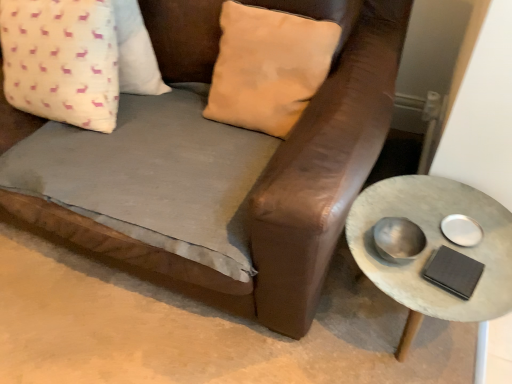
Question: Does white fabric pillow with pink deer pattern at upper left, placed as the 1th pillow when sorted from left to right, have a larger size compared to rustic concrete side table at right?

Choices:
 (A) yes
 (B) no

Answer: (B)

Question: Is white fabric pillow with pink deer pattern at upper left, the 2th pillow positioned from the right, to the right of rustic concrete side table at right from the viewer's perspective?

Choices:
 (A) yes
 (B) no

Answer: (B)

Question: Can you confirm if white fabric pillow with pink deer pattern at upper left, placed as the 1th pillow when sorted from left to right, is wider than rustic concrete side table at right?

Choices:
 (A) yes
 (B) no

Answer: (B)

Question: Is white fabric pillow with pink deer pattern at upper left, the 2th pillow positioned from the right, behind rustic concrete side table at right?

Choices:
 (A) yes
 (B) no

Answer: (A)

Question: Is white fabric pillow with pink deer pattern at upper left, the 2th pillow positioned from the right, smaller than rustic concrete side table at right?

Choices:
 (A) yes
 (B) no

Answer: (A)

Question: Is white fabric pillow with pink deer pattern at upper left, placed as the 1th pillow when sorted from left to right, next to rustic concrete side table at right?

Choices:
 (A) no
 (B) yes

Answer: (A)

Question: Is brown leather couch at center completely or partially outside of beige suede pillow at upper center, which is the first pillow in right-to-left order?

Choices:
 (A) no
 (B) yes

Answer: (B)

Question: Can you confirm if brown leather couch at center is wider than beige suede pillow at upper center, which is the first pillow in right-to-left order?

Choices:
 (A) no
 (B) yes

Answer: (B)

Question: Is brown leather couch at center oriented towards beige suede pillow at upper center, which is the first pillow in right-to-left order?

Choices:
 (A) no
 (B) yes

Answer: (A)

Question: Is brown leather couch at center taller than beige suede pillow at upper center, which is the first pillow in right-to-left order?

Choices:
 (A) yes
 (B) no

Answer: (B)

Question: Is brown leather couch at center not near beige suede pillow at upper center, which is the first pillow in right-to-left order?

Choices:
 (A) yes
 (B) no

Answer: (B)

Question: Can you confirm if brown leather couch at center is shorter than beige suede pillow at upper center, which is the 2th pillow from left to right?

Choices:
 (A) yes
 (B) no

Answer: (A)

Question: Are beige suede pillow at upper center, which is the first pillow in right-to-left order, and rustic concrete side table at right far apart?

Choices:
 (A) yes
 (B) no

Answer: (B)